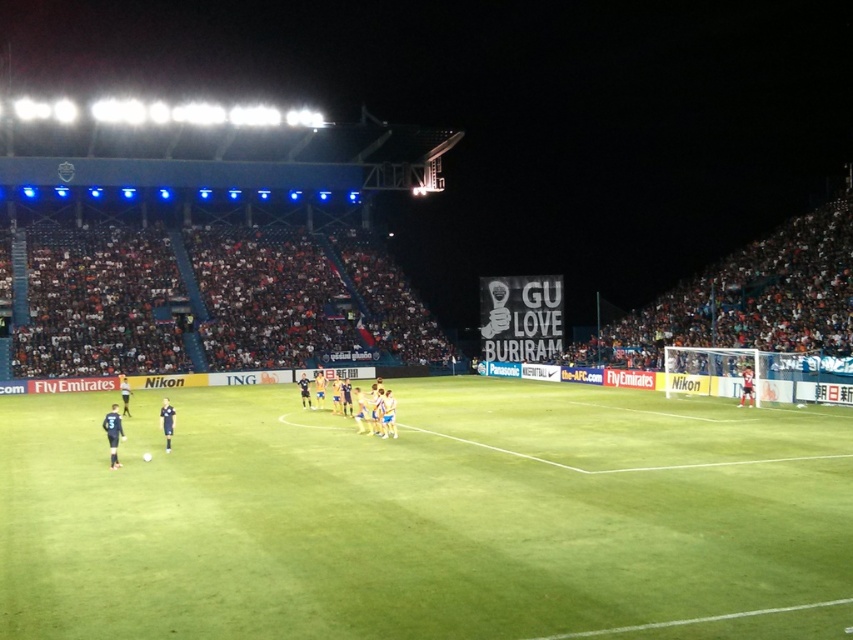
Can you confirm if green grass football field at center is thinner than blue fabric jersey at center?

No.

Where is `green grass football field at center`? green grass football field at center is located at coordinates (426, 516).